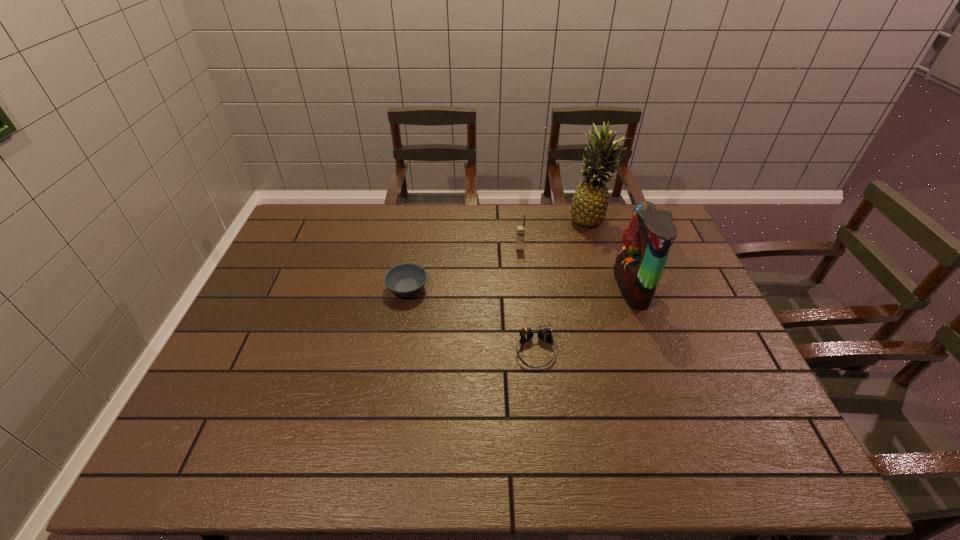
Find the location of a particular element. free spot between the leftmost object and the pineapple is located at coordinates (499, 253).

Find the location of a particular element. free point between the leftmost object and the nearest object is located at coordinates (471, 320).

Select which object is the closest to the parrot. Please provide its 2D coordinates. Your answer should be formatted as a tuple, i.e. [(x, y)], where the tuple contains the x and y coordinates of a point satisfying the conditions above.

[(589, 204)]

This screenshot has height=540, width=960. What are the coordinates of `object that is the third closest to the parrot` in the screenshot? It's located at (520, 229).